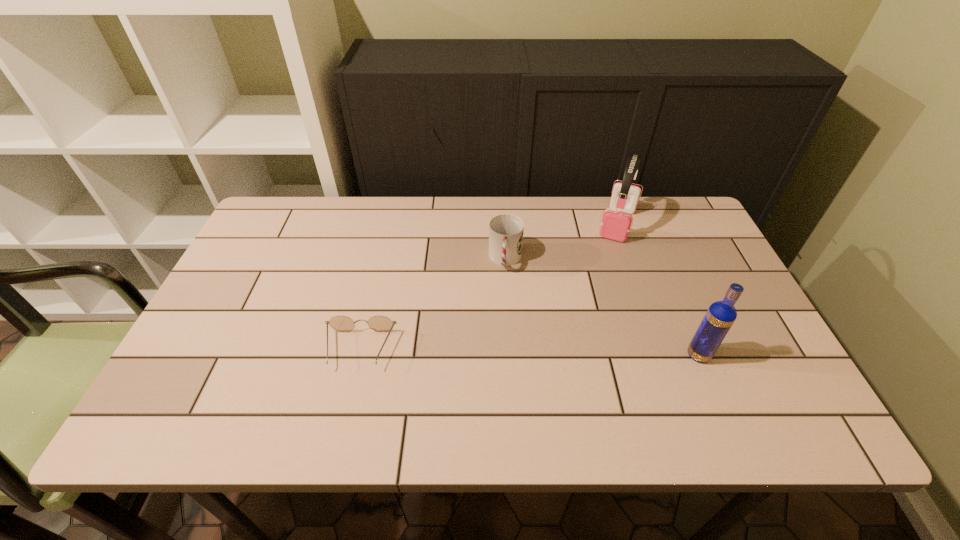
This screenshot has height=540, width=960. In the image, there is a desktop. Find the location of `vacant region at the near edge`. vacant region at the near edge is located at coordinates (377, 365).

The height and width of the screenshot is (540, 960). Identify the location of free point at the left edge. (249, 262).

What are the coordinates of `free space at the far left corner of the desktop` in the screenshot? It's located at (274, 208).

You are a GUI agent. You are given a task and a screenshot of the screen. Output one action in this format:
    pyautogui.click(x=<x>, y=<y>)
    Task: Click on the free space at the near left corner of the desktop
    
    Given the screenshot: What is the action you would take?
    pyautogui.click(x=232, y=365)

At what (x,y) coordinates should I click in order to perform the action: click on blank space at the near right corner. Please return your answer as a coordinate pair (x, y). Image resolution: width=960 pixels, height=540 pixels. Looking at the image, I should click on (746, 372).

You are a GUI agent. You are given a task and a screenshot of the screen. Output one action in this format:
    pyautogui.click(x=<x>, y=<y>)
    Task: Click on the free space between the earphone and the shortest object
    
    Given the screenshot: What is the action you would take?
    pyautogui.click(x=489, y=287)

Locate an element on the screen. The width and height of the screenshot is (960, 540). vacant point located between the vodka and the cup is located at coordinates (602, 307).

Where is `free space that is in between the spectacles and the earphone`? This screenshot has height=540, width=960. free space that is in between the spectacles and the earphone is located at coordinates (489, 287).

Find the location of `free space between the earphone and the vodka`. free space between the earphone and the vodka is located at coordinates (658, 289).

I want to click on free space that is in between the third object from right to left and the spectacles, so click(433, 305).